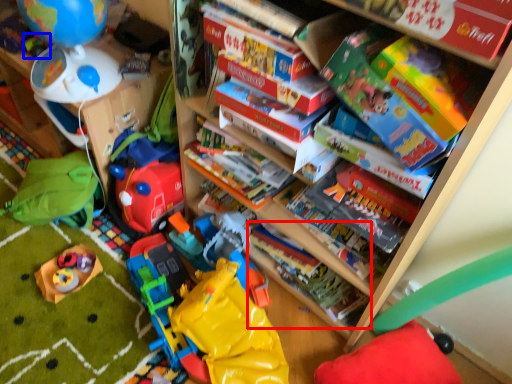
Question: Among these objects, which one is farthest to the camera, book (highlighted by a red box) or toy (highlighted by a blue box)?

Choices:
 (A) book
 (B) toy

Answer: (B)